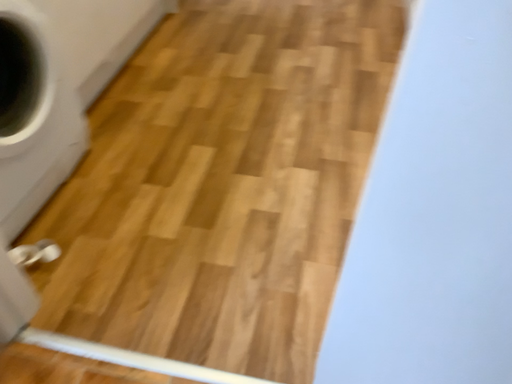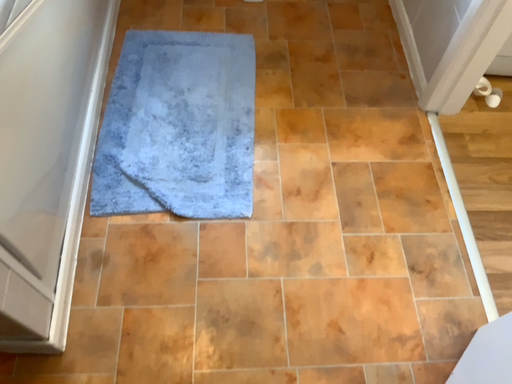
Question: How did the camera likely rotate when shooting the video?

Choices:
 (A) rotated left
 (B) rotated right

Answer: (A)